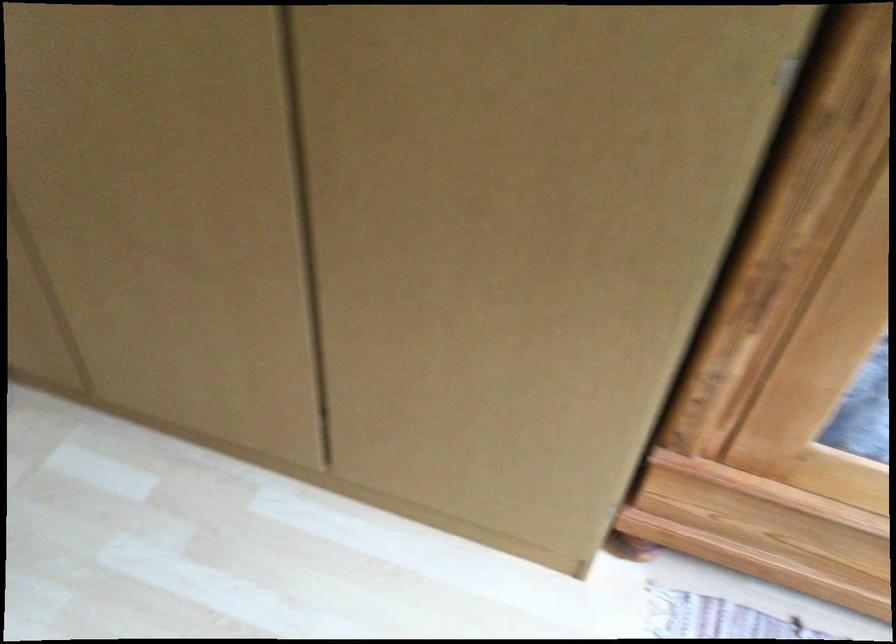
The first image is from the beginning of the video and the second image is from the end. How did the camera likely rotate when shooting the video?

The camera rotated toward right-down.